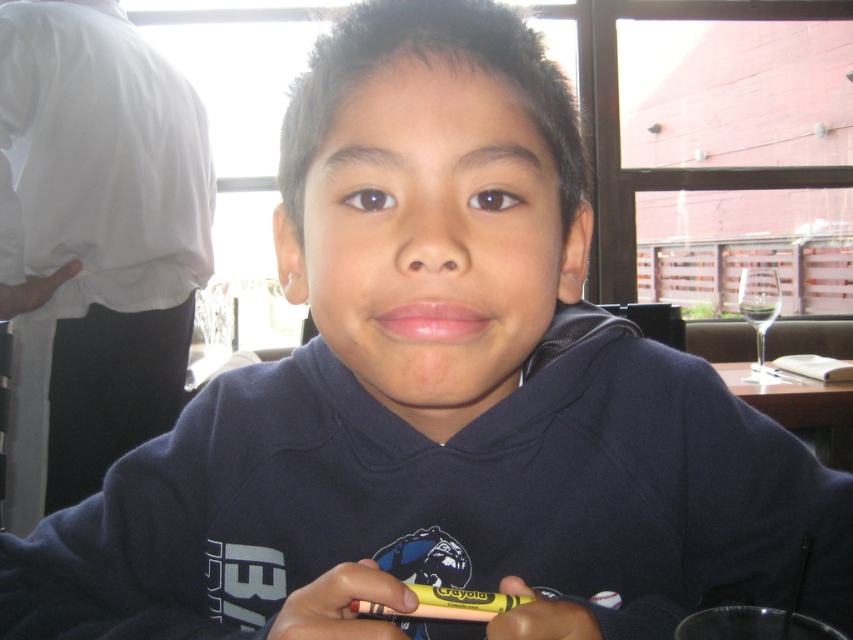
Consider the image. Is yellow matte crayon at center wider than yellow plastic crayon at lower center?

Yes.

Between point (310, 602) and point (520, 621), which one is positioned in front?

Positioned in front is point (520, 621).

Which is in front, point (379, 625) or point (544, 636)?

Point (379, 625)

Image resolution: width=853 pixels, height=640 pixels. In order to click on yellow matte crayon at center in this screenshot , I will do `click(341, 604)`.

Does yellow matte crayon at center appear under wooden table at center?

Actually, yellow matte crayon at center is above wooden table at center.

In order to click on yellow matte crayon at center in this screenshot , I will do `click(341, 604)`.

The image size is (853, 640). What are the coordinates of `yellow matte crayon at center` in the screenshot? It's located at (341, 604).

Is wooden table at center below yellow plastic crayon at lower center?

Indeed, wooden table at center is positioned under yellow plastic crayon at lower center.

The height and width of the screenshot is (640, 853). What do you see at coordinates (801, 410) in the screenshot? I see `wooden table at center` at bounding box center [801, 410].

Measure the distance between point (813,445) and camera.

They are 6.27 feet apart.

What are the coordinates of `wooden table at center` in the screenshot? It's located at (801, 410).